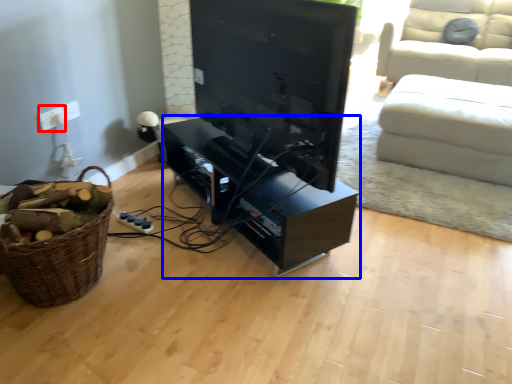
Question: Which object is further to the camera taking this photo, electric outlet (highlighted by a red box) or entertainment center (highlighted by a blue box)?

Choices:
 (A) electric outlet
 (B) entertainment center

Answer: (A)